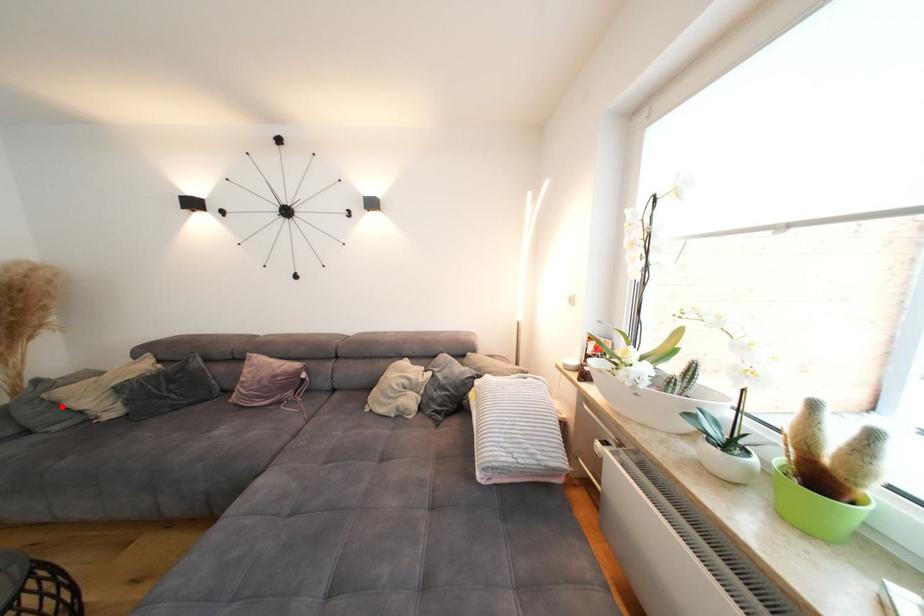
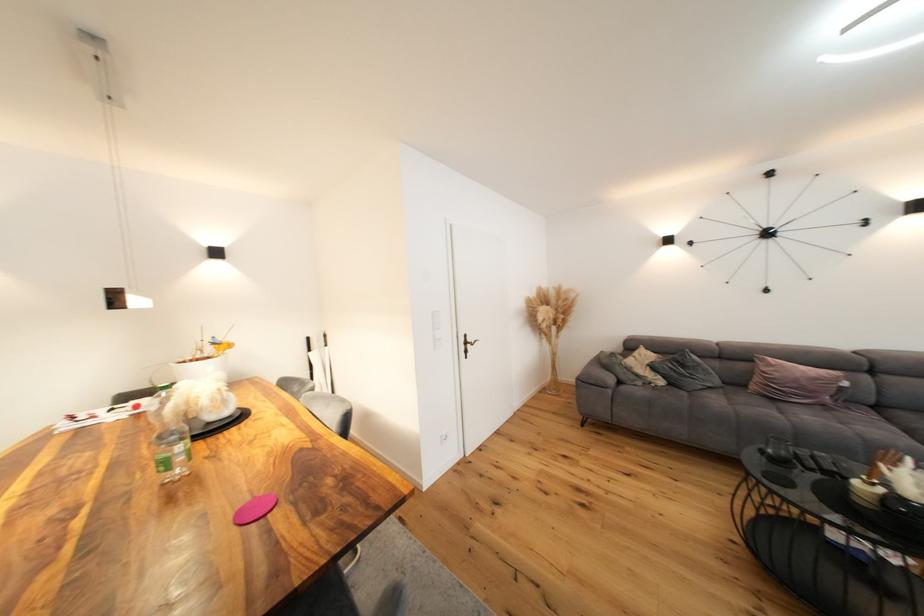
Find the pixel in the second image that matches the highlighted location in the first image.

(637, 371)